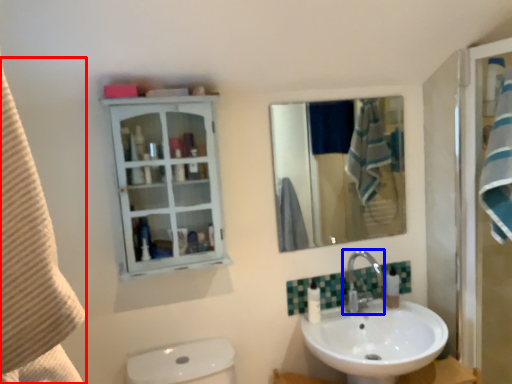
Question: Among these objects, which one is nearest to the camera, beach towel (highlighted by a red box) or tap (highlighted by a blue box)?

Choices:
 (A) beach towel
 (B) tap

Answer: (A)